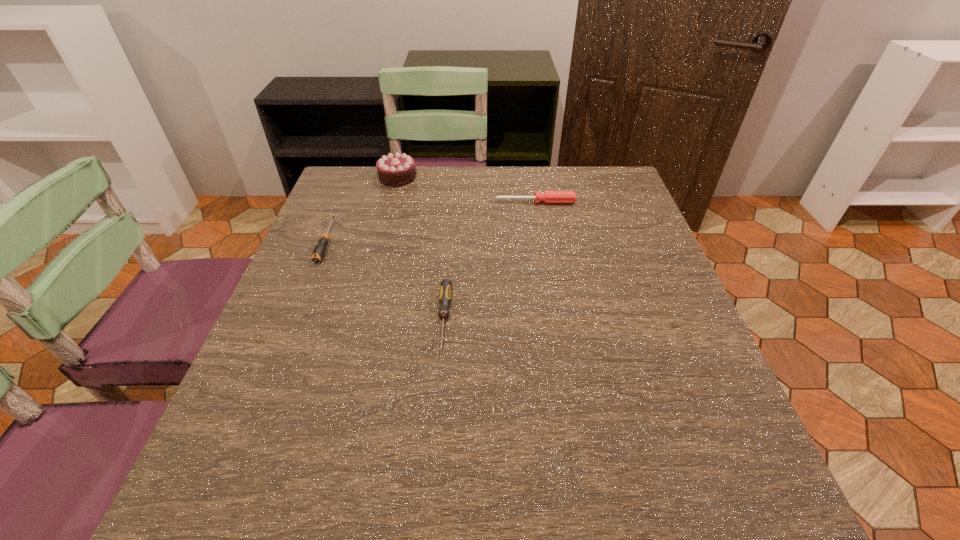
Identify the location of blank area located on the front of the leftmost screwdriver. The height and width of the screenshot is (540, 960). (270, 380).

Identify the location of vacant space located 0.290m insert the second screwdriver from right to left into a screw head. (428, 519).

Find the location of a particular element. This screenshot has width=960, height=540. chocolate cake that is at the far edge is located at coordinates (394, 170).

Locate an element on the screen. Image resolution: width=960 pixels, height=540 pixels. screwdriver situated at the far edge is located at coordinates (549, 196).

Where is `chocolate cake located at the left edge`? chocolate cake located at the left edge is located at coordinates (394, 170).

Where is `screwdriver that is positioned at the left edge`? The width and height of the screenshot is (960, 540). screwdriver that is positioned at the left edge is located at coordinates (319, 250).

Find the location of a particular element. The height and width of the screenshot is (540, 960). object that is at the right edge is located at coordinates (549, 196).

Locate an element on the screen. object that is at the far left corner is located at coordinates (394, 170).

I want to click on object at the far right corner, so click(549, 196).

In order to click on vacant area at the near edge in this screenshot , I will do `click(599, 518)`.